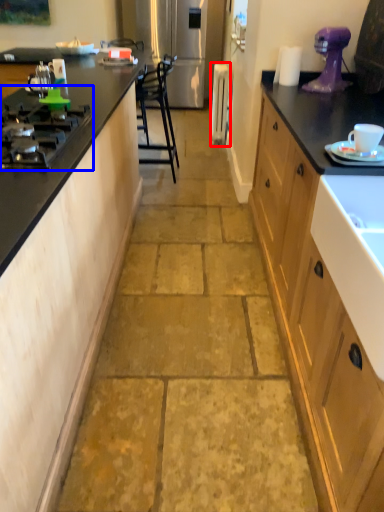
Question: Which object appears closest to the camera in this image, appliance (highlighted by a red box) or gas stove (highlighted by a blue box)?

Choices:
 (A) appliance
 (B) gas stove

Answer: (B)